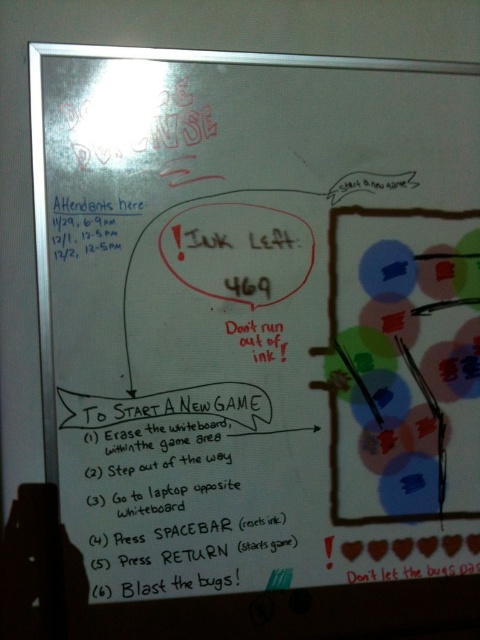
Question: From the image, what is the correct spatial relationship of black handwritten text at center in relation to black marker text at upper left?

Choices:
 (A) above
 (B) below

Answer: (B)

Question: Which point is farther to the camera?

Choices:
 (A) (60, 241)
 (B) (169, 436)

Answer: (B)

Question: Which object appears farthest from the camera in this image?

Choices:
 (A) black marker text at upper left
 (B) black handwritten text at center

Answer: (B)

Question: Can you confirm if black handwritten text at center is positioned above black marker text at upper left?

Choices:
 (A) yes
 (B) no

Answer: (B)

Question: Which point is farther to the camera?

Choices:
 (A) black marker text at upper left
 (B) black handwritten text at center

Answer: (B)

Question: Does black handwritten text at center have a smaller size compared to black marker text at upper left?

Choices:
 (A) yes
 (B) no

Answer: (B)